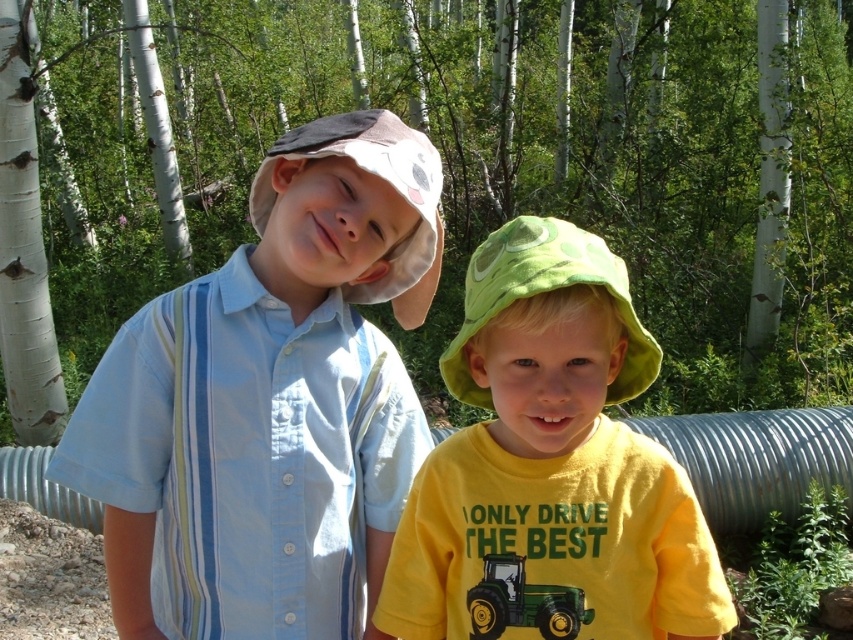
Who is lower down, light blue striped shirt at center or yellow matte shirt at center?

yellow matte shirt at center is below.

Does light blue striped shirt at center have a lesser height compared to yellow matte shirt at center?

No.

You are a GUI agent. You are given a task and a screenshot of the screen. Output one action in this format:
    pyautogui.click(x=<x>, y=<y>)
    Task: Click on the light blue striped shirt at center
    The height and width of the screenshot is (640, 853).
    Given the screenshot: What is the action you would take?
    pyautogui.click(x=267, y=401)

Find the location of a particular element. The width and height of the screenshot is (853, 640). light blue striped shirt at center is located at coordinates (267, 401).

Which is more to the left, light blue striped shirt at center or green matte tractor at lower center?

Positioned to the left is light blue striped shirt at center.

How much distance is there between light blue striped shirt at center and green matte tractor at lower center?

The distance of light blue striped shirt at center from green matte tractor at lower center is 18.01 inches.

Describe the element at coordinates (267, 401) in the screenshot. The image size is (853, 640). I see `light blue striped shirt at center` at that location.

At what (x,y) coordinates should I click in order to perform the action: click on light blue striped shirt at center. Please return your answer as a coordinate pair (x, y). This screenshot has height=640, width=853. Looking at the image, I should click on (267, 401).

Consider the image. Can you confirm if green leafy tree at center is positioned to the right of light blue striped shirt at center?

Correct, you'll find green leafy tree at center to the right of light blue striped shirt at center.

Does green leafy tree at center have a lesser width compared to light blue striped shirt at center?

Incorrect, green leafy tree at center's width is not less than light blue striped shirt at center's.

Is point (795, 38) in front of point (65, 451)?

No, it is not.

Where is `green leafy tree at center`? This screenshot has width=853, height=640. green leafy tree at center is located at coordinates (561, 154).